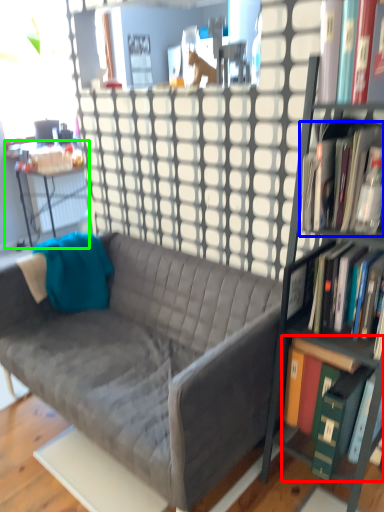
Question: Estimate the real-world distances between objects in this image. Which object is closer to book (highlighted by a red box), book (highlighted by a blue box) or desk (highlighted by a green box)?

Choices:
 (A) book
 (B) desk

Answer: (A)